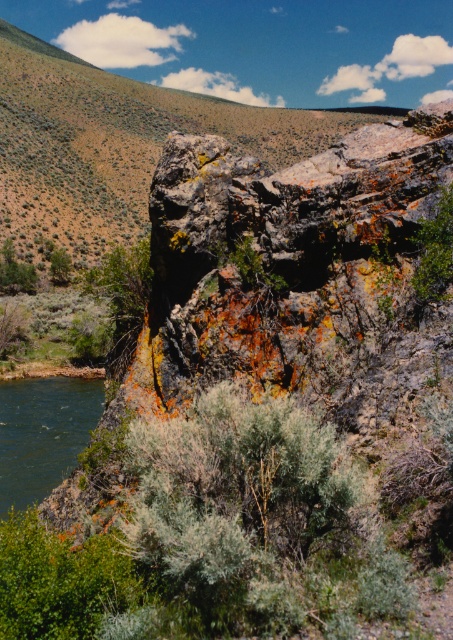
Can you confirm if green leafy shrub at center is wider than green leafy shrub at left?

Incorrect, green leafy shrub at center's width does not surpass green leafy shrub at left's.

Is point (429, 227) behind point (1, 282)?

No, (429, 227) is closer to viewer.

Is point (443, 256) farther from viewer compared to point (0, 285)?

No.

Locate an element on the screen. green leafy shrub at center is located at coordinates (434, 250).

Is dark green water at lower left thinner than green leafy shrub at center?

No, dark green water at lower left is not thinner than green leafy shrub at center.

Who is more forward, (72, 419) or (437, 214)?

Positioned in front is point (437, 214).

Which is in front, point (62, 403) or point (444, 225)?

Positioned in front is point (444, 225).

The image size is (453, 640). Identify the location of dark green water at lower left. (43, 433).

Does dark green water at lower left have a lesser width compared to green leafy shrub at left?

No, dark green water at lower left is not thinner than green leafy shrub at left.

Does point (4, 461) lie behind point (6, 241)?

No, it is in front of (6, 241).

At what (x,y) coordinates should I click in order to perform the action: click on dark green water at lower left. Please return your answer as a coordinate pair (x, y). Looking at the image, I should click on (43, 433).